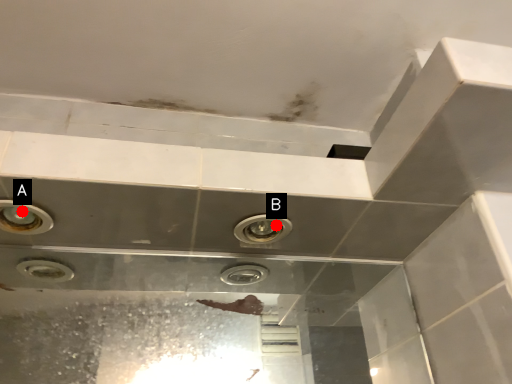
Question: Two points are circled on the image, labeled by A and B beside each circle. Which point appears closest to the camera in this image?

Choices:
 (A) A is closer
 (B) B is closer

Answer: (A)